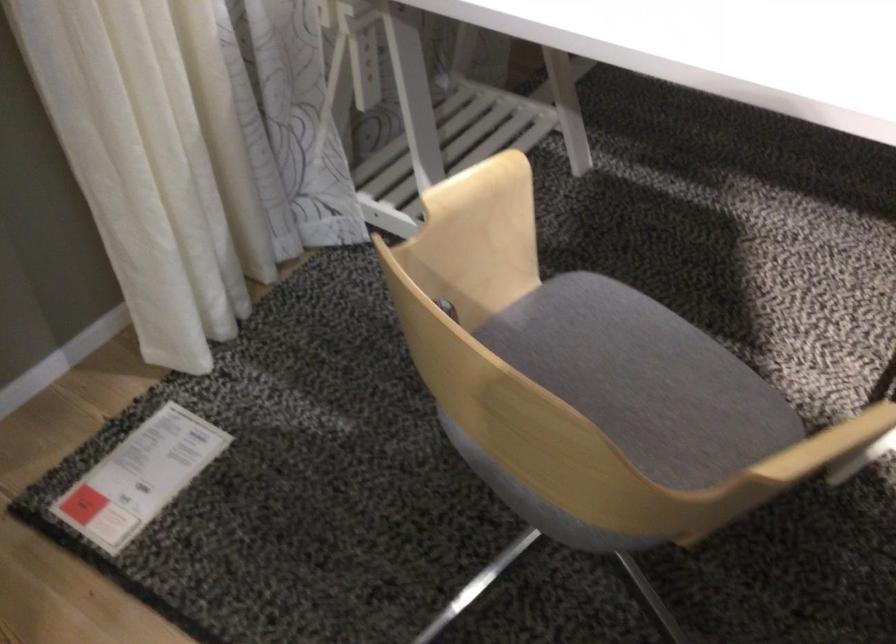
What do you see at coordinates (644, 380) in the screenshot? I see `the grey chair sitting surface` at bounding box center [644, 380].